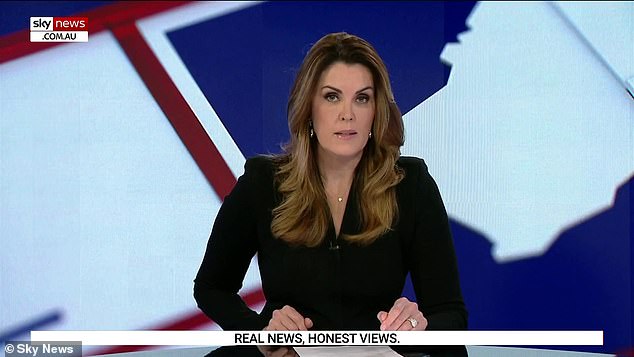
Where is `background screen`? The image size is (634, 357). background screen is located at coordinates (155, 104), (508, 91).